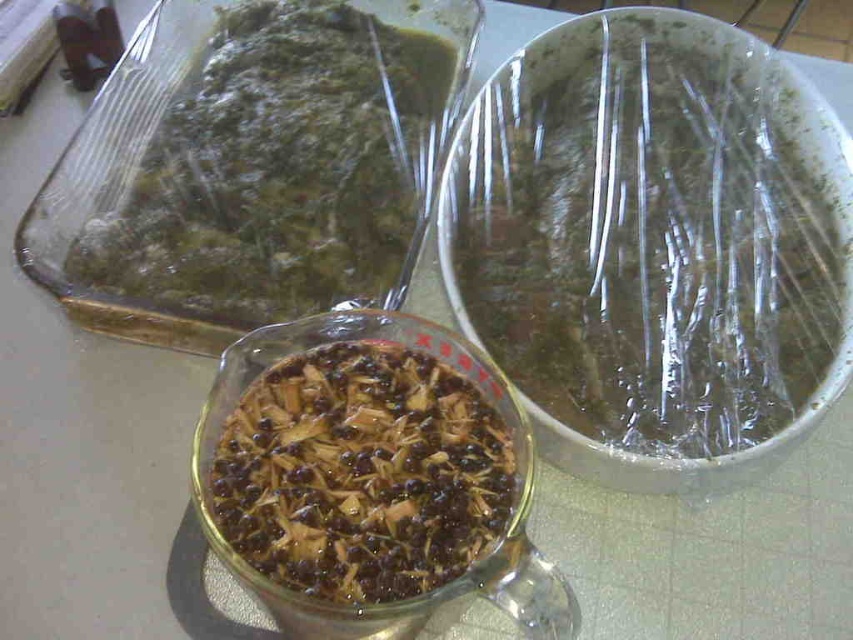
Question: Which of the following is the farthest from the observer?

Choices:
 (A) green matte cake at center
 (B) transparent plastic bowl at upper right

Answer: (A)

Question: Which of the following is the closest to the observer?

Choices:
 (A) brown matte glass bowl at center
 (B) transparent plastic bowl at upper right

Answer: (A)

Question: Can you confirm if transparent plastic bowl at upper right is positioned below green matte cake at center?

Choices:
 (A) no
 (B) yes

Answer: (B)

Question: Does transparent plastic bowl at upper right appear on the right side of green matte cake at center?

Choices:
 (A) yes
 (B) no

Answer: (A)

Question: Observing the image, what is the correct spatial positioning of transparent plastic bowl at upper right in reference to brown matte glass bowl at center?

Choices:
 (A) right
 (B) left

Answer: (A)

Question: Which point is farther to the camera?

Choices:
 (A) (325, 564)
 (B) (679, 221)
 (C) (363, 67)

Answer: (C)